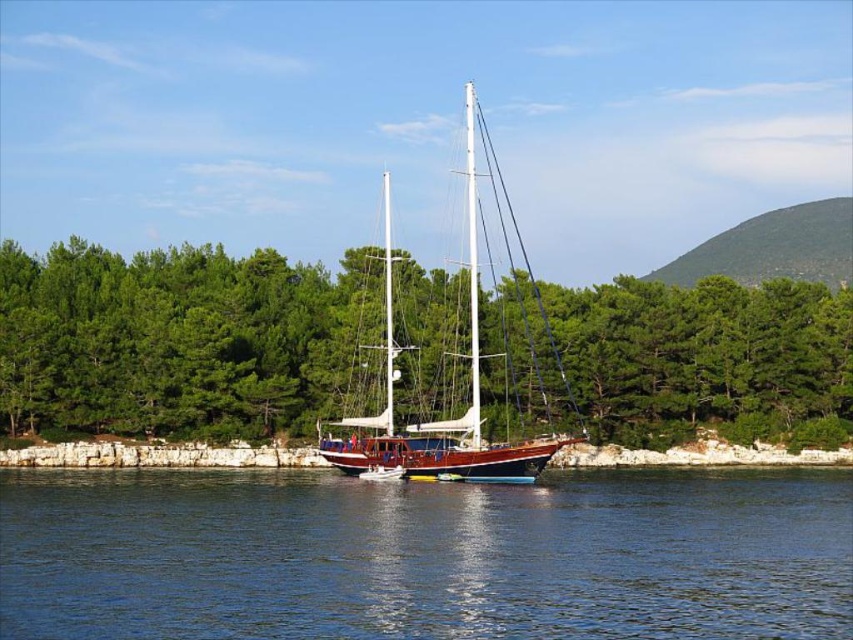
Based on the photo, you are a sailor planning to dock your boat. You see the blue water at center and the wooden sailboat at center in the image. Which area is wider for safe passage?

The blue water at center is wider than the wooden sailboat at center, so the blue water at center provides a wider area for safe passage.